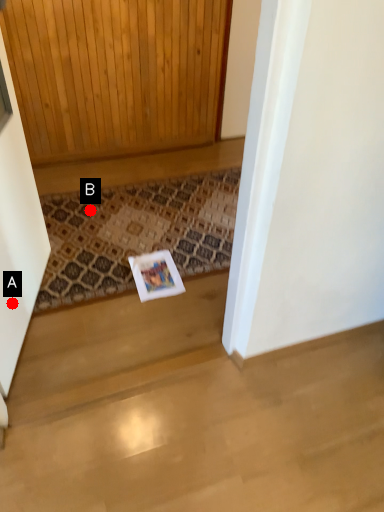
Question: Two points are circled on the image, labeled by A and B beside each circle. Which point appears farthest from the camera in this image?

Choices:
 (A) A is further
 (B) B is further

Answer: (B)